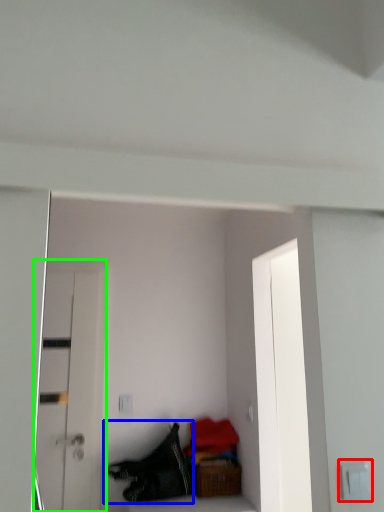
Question: Which object is the farthest from electric outlet (highlighted by a red box)? Choose among these: clothing (highlighted by a blue box) or door (highlighted by a green box).

Choices:
 (A) clothing
 (B) door

Answer: (B)